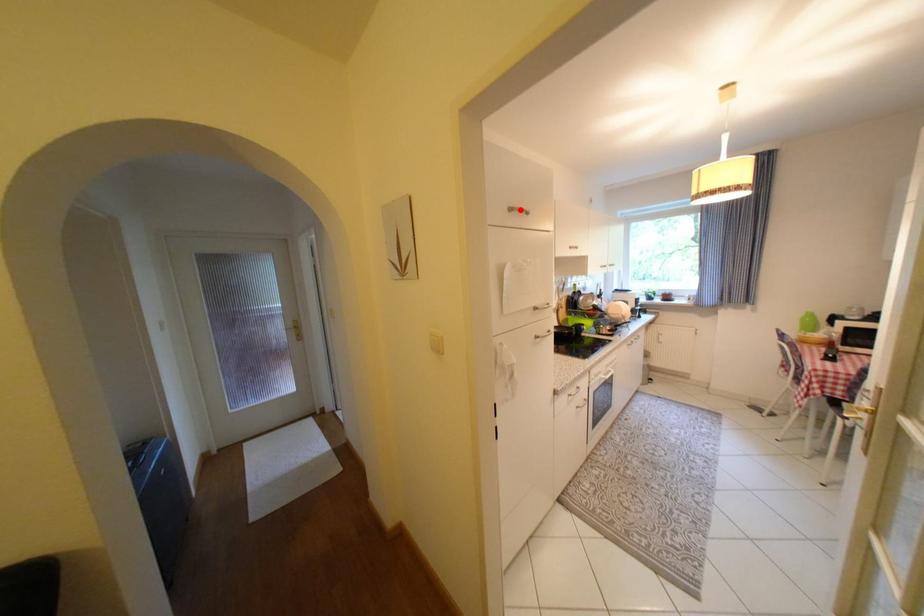
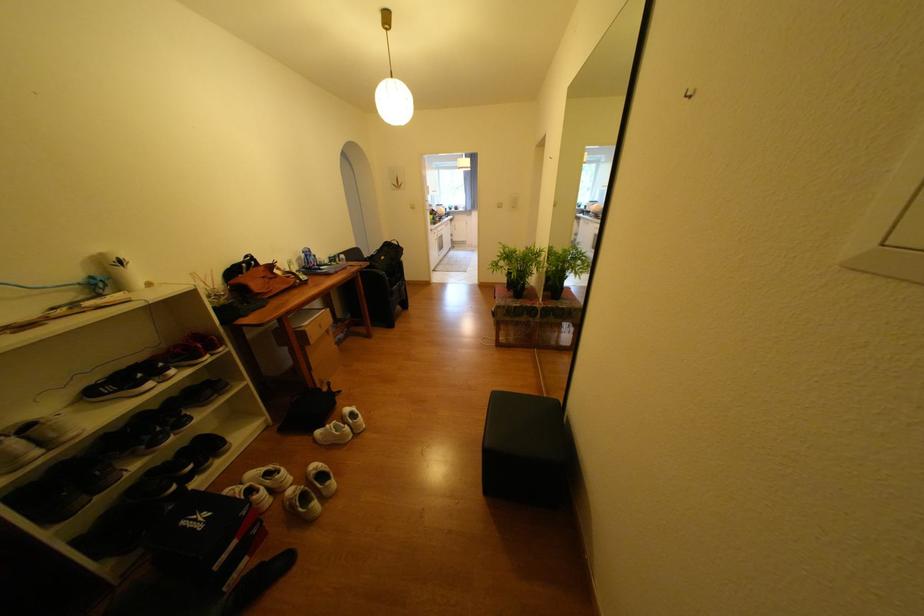
Question: I am providing you with two images of the same scene from different viewpoints. A red point is marked on the first image. Is the red point's position out of view in image 2?

Choices:
 (A) Yes
 (B) No

Answer: (A)